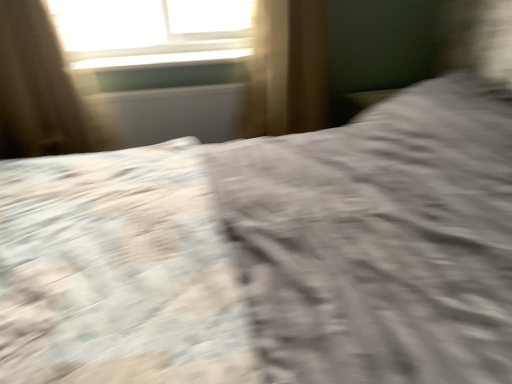
What do you see at coordinates (38, 89) in the screenshot? The height and width of the screenshot is (384, 512). I see `brown fabric curtain at upper left` at bounding box center [38, 89].

The width and height of the screenshot is (512, 384). Find the location of `textured gray sheet at center`. textured gray sheet at center is located at coordinates (117, 272).

Locate an element on the screen. brown fabric curtain at upper left is located at coordinates (38, 89).

From a real-world perspective, which object stands above the other?

From a 3D spatial view, brown fabric curtain at upper left is above.

Is textured gray sheet at center positioned far away from brown fabric curtain at upper left?

No.

Considering the sizes of objects textured gray sheet at center and brown fabric curtain at upper left in the image provided, who is bigger, textured gray sheet at center or brown fabric curtain at upper left?

With larger size is textured gray sheet at center.

Visually, is white glossy window sill at upper center positioned to the left or to the right of brown fabric curtain at upper left?

Based on their positions, white glossy window sill at upper center is located to the right of brown fabric curtain at upper left.

Consider the image. From the image's perspective, which one is positioned lower, white glossy window sill at upper center or brown fabric curtain at upper left?

brown fabric curtain at upper left appears lower in the image.

Considering the relative sizes of white glossy window sill at upper center and brown fabric curtain at upper left in the image provided, is white glossy window sill at upper center taller than brown fabric curtain at upper left?

No, white glossy window sill at upper center is not taller than brown fabric curtain at upper left.

Does point (192, 62) come behind point (53, 134)?

Yes, point (192, 62) is farther from viewer.

Could you tell me if brown fabric curtain at upper left is turned towards textured gray sheet at center?

Yes, brown fabric curtain at upper left is aimed at textured gray sheet at center.

Visually, is brown fabric curtain at upper left positioned to the left or to the right of textured gray sheet at center?

Clearly, brown fabric curtain at upper left is on the left of textured gray sheet at center in the image.

Considering the relative positions of brown fabric curtain at upper left and textured gray sheet at center in the image provided, is brown fabric curtain at upper left in front of textured gray sheet at center?

No, brown fabric curtain at upper left is behind textured gray sheet at center.

Looking at this image, is white glossy window sill at upper center positioned beyond the bounds of textured gray sheet at center?

white glossy window sill at upper center lies outside textured gray sheet at center's area.

Considering the points (184, 54) and (106, 235), which point is in front, point (184, 54) or point (106, 235)?

The point (106, 235) is closer.

Which of these two, white glossy window sill at upper center or textured gray sheet at center, is bigger?

With larger size is textured gray sheet at center.

Where is `curtain lying in front of the white glossy window sill at upper center`? The image size is (512, 384). curtain lying in front of the white glossy window sill at upper center is located at coordinates click(38, 89).

Does brown fabric curtain at upper left have a greater width compared to white glossy window sill at upper center?

No, brown fabric curtain at upper left is not wider than white glossy window sill at upper center.

From the image's perspective, does brown fabric curtain at upper left appear lower than white glossy window sill at upper center?

Yes, from the image's perspective, brown fabric curtain at upper left is below white glossy window sill at upper center.

From a real-world perspective, between brown fabric curtain at upper left and white glossy window sill at upper center, who is vertically lower?

brown fabric curtain at upper left is physically lower.

Which object is thinner, textured gray sheet at center or white glossy window sill at upper center?

white glossy window sill at upper center is thinner.

Is textured gray sheet at center positioned with its back to white glossy window sill at upper center?

textured gray sheet at center is not turned away from white glossy window sill at upper center.

What are the coordinates of `sheet in front of the white glossy window sill at upper center` in the screenshot? It's located at (117, 272).

What's the angular difference between textured gray sheet at center and white glossy window sill at upper center's facing directions?

The angular difference between textured gray sheet at center and white glossy window sill at upper center is 90.2 degrees.

The image size is (512, 384). Find the location of `sheet in front of the brown fabric curtain at upper left`. sheet in front of the brown fabric curtain at upper left is located at coordinates point(117,272).

Where is `window sill to the right of brown fabric curtain at upper left`? This screenshot has height=384, width=512. window sill to the right of brown fabric curtain at upper left is located at coordinates (161, 55).

Based on their spatial positions, is textured gray sheet at center or white glossy window sill at upper center closer to brown fabric curtain at upper left?

The object closer to brown fabric curtain at upper left is white glossy window sill at upper center.

From the image, which object appears to be nearer to brown fabric curtain at upper left, white glossy window sill at upper center or textured gray sheet at center?

The object closer to brown fabric curtain at upper left is white glossy window sill at upper center.

When comparing their distances from white glossy window sill at upper center, does textured gray sheet at center or brown fabric curtain at upper left seem further?

The object further to white glossy window sill at upper center is textured gray sheet at center.

When comparing their distances from textured gray sheet at center, does white glossy window sill at upper center or brown fabric curtain at upper left seem closer?

brown fabric curtain at upper left is positioned closer to the anchor textured gray sheet at center.

Which object lies further to the anchor point white glossy window sill at upper center, brown fabric curtain at upper left or textured gray sheet at center?

textured gray sheet at center is positioned further to the anchor white glossy window sill at upper center.

In the scene shown: Based on their spatial positions, is brown fabric curtain at upper left or white glossy window sill at upper center further from textured gray sheet at center?

white glossy window sill at upper center is positioned further to the anchor textured gray sheet at center.

Identify the location of curtain between textured gray sheet at center and white glossy window sill at upper center in the front-back direction. The image size is (512, 384). click(x=38, y=89).